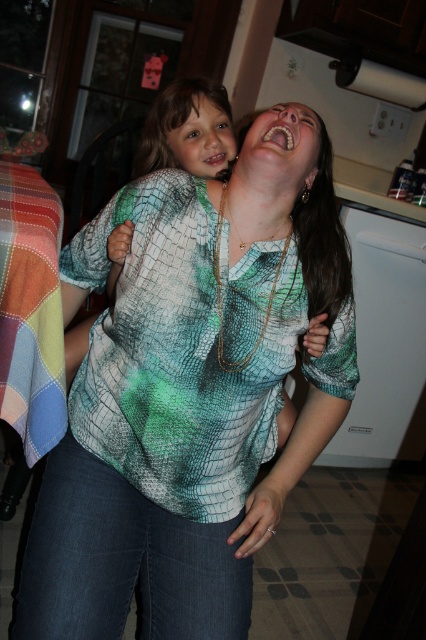
Does green printed blouse at center appear on the left side of matte green shirt at upper center?

In fact, green printed blouse at center is to the right of matte green shirt at upper center.

In order to click on green printed blouse at center in this screenshot , I will do (x=192, y=392).

Which is behind, point (288, 300) or point (189, 124)?

The point (189, 124) is behind.

Locate an element on the screen. The height and width of the screenshot is (640, 426). green printed blouse at center is located at coordinates (192, 392).

Does green printed blouse at center appear under printed fabric shirt at center?

Correct, green printed blouse at center is located below printed fabric shirt at center.

Who is positioned more to the left, green printed blouse at center or printed fabric shirt at center?

Positioned to the left is printed fabric shirt at center.

Based on the photo, who is more forward, (95, 593) or (147, 154)?

Positioned in front is point (95, 593).

Locate an element on the screen. The width and height of the screenshot is (426, 640). green printed blouse at center is located at coordinates (192, 392).

Is printed fabric shirt at center shorter than matte green shirt at upper center?

Correct, printed fabric shirt at center is not as tall as matte green shirt at upper center.

Does printed fabric shirt at center lie in front of matte green shirt at upper center?

No.

Is point (215, 163) positioned behind point (161, 108)?

No, it is in front of (161, 108).

Locate an element on the screen. The width and height of the screenshot is (426, 640). printed fabric shirt at center is located at coordinates (187, 129).